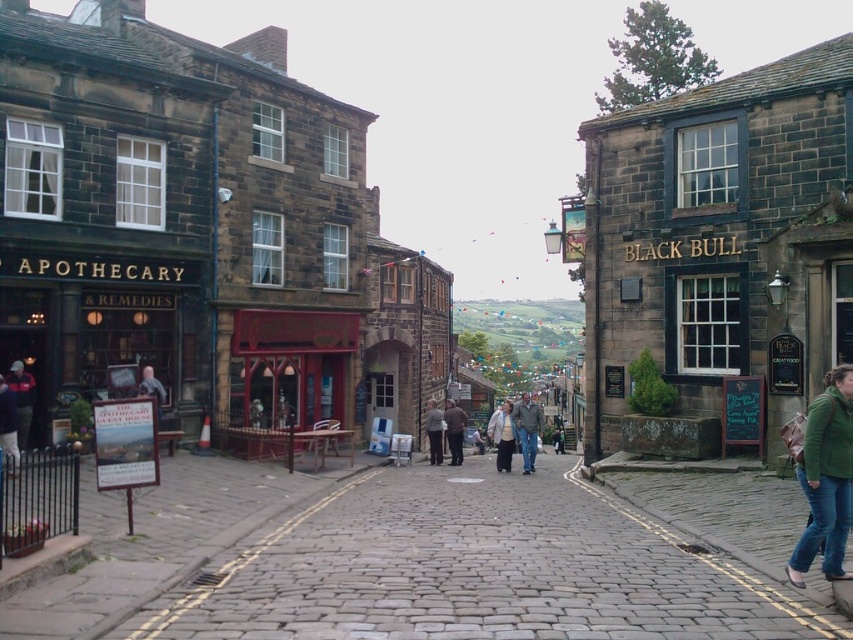
Question: Estimate the real-world distances between objects in this image. Which object is farther from the matte black signboard at center-left?

Choices:
 (A) denim jacket at center
 (B) dark blue jacket at left
 (C) light gray fabric jacket at center
 (D) dark gray jacket at center

Answer: (A)

Question: Estimate the real-world distances between objects in this image. Which object is farther from the matte black signboard at center-left?

Choices:
 (A) denim jacket at center
 (B) red wooden shop at center

Answer: (A)

Question: Observing the image, what is the correct spatial positioning of red wooden shop at center in reference to dark gray fabric coat at center?

Choices:
 (A) above
 (B) below

Answer: (A)

Question: Which point is closer to the camera?

Choices:
 (A) (840, 547)
 (B) (537, 428)

Answer: (A)

Question: Is denim jacket at center thinner than dark gray jacket at center?

Choices:
 (A) no
 (B) yes

Answer: (A)

Question: Can you confirm if dark blue jeans at lower left is positioned to the left of dark brown leather jacket at center?

Choices:
 (A) no
 (B) yes

Answer: (B)